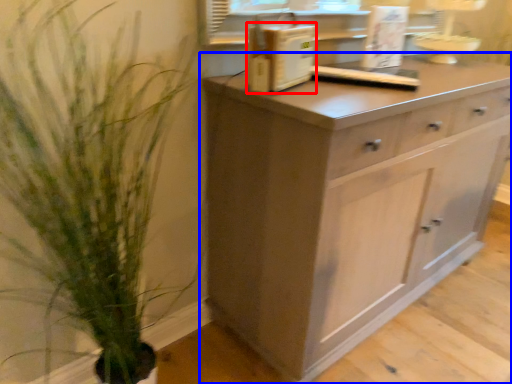
Question: Among these objects, which one is farthest to the camera, appliance (highlighted by a red box) or chest of drawers (highlighted by a blue box)?

Choices:
 (A) appliance
 (B) chest of drawers

Answer: (A)